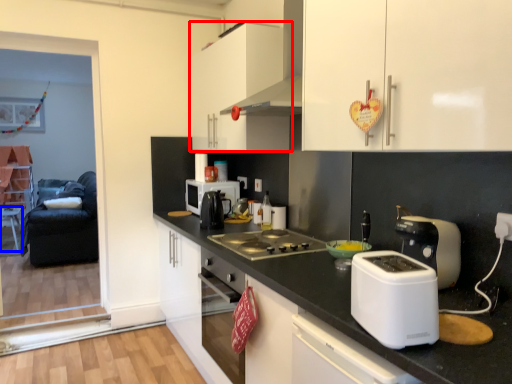
Question: Among these objects, which one is farthest to the camera, cabinetry (highlighted by a red box) or table (highlighted by a blue box)?

Choices:
 (A) cabinetry
 (B) table

Answer: (B)